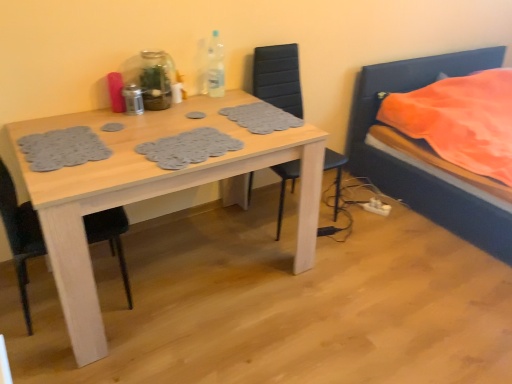
You are a GUI agent. You are given a task and a screenshot of the screen. Output one action in this format:
    pyautogui.click(x=<x>, y=<y>)
    Task: Click on the clear plastic bottle at upper center, the first bottle positioned from the right
    This screenshot has width=512, height=384.
    Given the screenshot: What is the action you would take?
    pyautogui.click(x=215, y=67)

What do you see at coordinates (20, 235) in the screenshot? The width and height of the screenshot is (512, 384). I see `black matte chair at left, which appears as the second chair when viewed from the right` at bounding box center [20, 235].

This screenshot has height=384, width=512. I want to click on white plastic power plugs and sockets at lower right, so click(x=376, y=207).

This screenshot has width=512, height=384. I want to click on black leather chair at center, marked as the 2th chair in a left-to-right arrangement, so [278, 77].

At what (x,y) coordinates should I click in order to perform the action: click on transparent glass bottle at upper center, which ranks as the 2th bottle in right-to-left order. Please return your answer as a coordinate pair (x, y). Looking at the image, I should click on (156, 80).

This screenshot has width=512, height=384. In order to click on orange fabric bed at right in this screenshot , I will do `click(415, 168)`.

From the picture: Is black matte chair at left, which ranks as the 1th chair in left-to-right order, further to camera compared to black leather chair at center, which ranks as the first chair in right-to-left order?

No.

Which point is more forward, (36,244) or (296,68)?

The point (36,244) is more forward.

In terms of width, does black matte chair at left, which ranks as the 1th chair in left-to-right order, look wider or thinner when compared to black leather chair at center, marked as the 2th chair in a left-to-right arrangement?

Clearly, black matte chair at left, which ranks as the 1th chair in left-to-right order, has less width compared to black leather chair at center, marked as the 2th chair in a left-to-right arrangement.

From a real-world perspective, is black matte chair at left, which appears as the second chair when viewed from the right, physically located above or below black leather chair at center, which ranks as the first chair in right-to-left order?

In terms of real-world spatial position, black matte chair at left, which appears as the second chair when viewed from the right, is above black leather chair at center, which ranks as the first chair in right-to-left order.

Is metallic silver shaker at table center, acting as the 1th bottle starting from the left, next to clear plastic bottle at upper center, which is the third bottle from left to right, and touching it?

No.

From a real-world perspective, does metallic silver shaker at table center, the 3th bottle positioned from the right, stand above clear plastic bottle at upper center, which is the third bottle from left to right?

No, from a real-world perspective, metallic silver shaker at table center, the 3th bottle positioned from the right, is not above clear plastic bottle at upper center, which is the third bottle from left to right.

Considering the sizes of objects metallic silver shaker at table center, the 3th bottle positioned from the right, and clear plastic bottle at upper center, the first bottle positioned from the right, in the image provided, who is smaller, metallic silver shaker at table center, the 3th bottle positioned from the right, or clear plastic bottle at upper center, the first bottle positioned from the right,?

metallic silver shaker at table center, the 3th bottle positioned from the right.

Consider the image. Are transparent glass bottle at upper center, which ranks as the 2th bottle in left-to-right order, and black leather chair at center, marked as the 2th chair in a left-to-right arrangement, making contact?

transparent glass bottle at upper center, which ranks as the 2th bottle in left-to-right order, and black leather chair at center, marked as the 2th chair in a left-to-right arrangement, are clearly separated.

From a real-world perspective, relative to black leather chair at center, marked as the 2th chair in a left-to-right arrangement, is transparent glass bottle at upper center, which ranks as the 2th bottle in left-to-right order, vertically above or below?

Clearly, from a real-world perspective, transparent glass bottle at upper center, which ranks as the 2th bottle in left-to-right order, is above black leather chair at center, marked as the 2th chair in a left-to-right arrangement.

Which is behind, transparent glass bottle at upper center, which ranks as the 2th bottle in right-to-left order, or black leather chair at center, which ranks as the first chair in right-to-left order?

transparent glass bottle at upper center, which ranks as the 2th bottle in right-to-left order, is more distant.

How much distance is there between transparent glass bottle at upper center, which ranks as the 2th bottle in left-to-right order, and black matte chair at left, which ranks as the 1th chair in left-to-right order?

transparent glass bottle at upper center, which ranks as the 2th bottle in left-to-right order, is 31.51 inches away from black matte chair at left, which ranks as the 1th chair in left-to-right order.

Is transparent glass bottle at upper center, which ranks as the 2th bottle in left-to-right order, placed right next to black matte chair at left, which appears as the second chair when viewed from the right?

No, transparent glass bottle at upper center, which ranks as the 2th bottle in left-to-right order, is not next to black matte chair at left, which appears as the second chair when viewed from the right.

Considering the positions of objects transparent glass bottle at upper center, which ranks as the 2th bottle in left-to-right order, and black matte chair at left, which ranks as the 1th chair in left-to-right order, in the image provided, who is behind, transparent glass bottle at upper center, which ranks as the 2th bottle in left-to-right order, or black matte chair at left, which ranks as the 1th chair in left-to-right order,?

transparent glass bottle at upper center, which ranks as the 2th bottle in left-to-right order, is behind.

From the image's perspective, is transparent glass bottle at upper center, which ranks as the 2th bottle in left-to-right order, positioned above or below black matte chair at left, which ranks as the 1th chair in left-to-right order?

Based on their image positions, transparent glass bottle at upper center, which ranks as the 2th bottle in left-to-right order, is located above black matte chair at left, which ranks as the 1th chair in left-to-right order.

Considering the sizes of light wood table at center and orange fabric bed at right in the image, is light wood table at center taller or shorter than orange fabric bed at right?

light wood table at center is shorter than orange fabric bed at right.

Which of these two, light wood table at center or orange fabric bed at right, is smaller?

With smaller size is light wood table at center.

From a real-world perspective, which is physically below, light wood table at center or orange fabric bed at right?

light wood table at center.

Is light wood table at center oriented towards orange fabric bed at right?

No, light wood table at center is not oriented towards orange fabric bed at right.

Is white plastic power plugs and sockets at lower right turned away from light wood table at center?

No, white plastic power plugs and sockets at lower right's orientation is not away from light wood table at center.

In the image, there is a light wood table at center. Where is `power plugs and sockets below it (from a real-world perspective)`? This screenshot has width=512, height=384. power plugs and sockets below it (from a real-world perspective) is located at coordinates (376, 207).

Which object is further away from the camera taking this photo, white plastic power plugs and sockets at lower right or light wood table at center?

white plastic power plugs and sockets at lower right is behind.

From a real-world perspective, which is physically below, white plastic power plugs and sockets at lower right or light wood table at center?

white plastic power plugs and sockets at lower right, from a real-world perspective.

Which is in front, point (18, 207) or point (318, 165)?

The point (18, 207) is more forward.

Consider the image. Can you confirm if black matte chair at left, which ranks as the 1th chair in left-to-right order, is shorter than light wood table at center?

Incorrect, the height of black matte chair at left, which ranks as the 1th chair in left-to-right order, does not fall short of that of light wood table at center.

Find the location of a particular element. chair that is the 2nd object above the light wood table at center (from a real-world perspective) is located at coordinates pyautogui.click(x=20, y=235).

Are black matte chair at left, which appears as the second chair when viewed from the right, and light wood table at center far apart?

No, black matte chair at left, which appears as the second chair when viewed from the right, is not far from light wood table at center.

You are a GUI agent. You are given a task and a screenshot of the screen. Output one action in this format:
    pyautogui.click(x=<x>, y=<y>)
    Task: Click on the chair on the left of black leather chair at center, marked as the 2th chair in a left-to-right arrangement
    
    Given the screenshot: What is the action you would take?
    click(x=20, y=235)

From the image's perspective, starting from the clear plastic bottle at upper center, which is the third bottle from left to right, which bottle is the 2nd one below? Please provide its 2D coordinates.

[(133, 99)]

Considering their positions, is clear plastic bottle at upper center, which is the third bottle from left to right, positioned closer to transparent glass bottle at upper center, which ranks as the 2th bottle in left-to-right order, than white plastic power plugs and sockets at lower right?

clear plastic bottle at upper center, which is the third bottle from left to right, is positioned closer to the anchor transparent glass bottle at upper center, which ranks as the 2th bottle in left-to-right order.

From the image, which object appears to be nearer to white plastic power plugs and sockets at lower right, metallic silver shaker at table center, the 3th bottle positioned from the right, or light wood table at center?

light wood table at center is positioned closer to the anchor white plastic power plugs and sockets at lower right.

Considering their positions, is white plastic power plugs and sockets at lower right positioned closer to light wood table at center than transparent glass bottle at upper center, which ranks as the 2th bottle in left-to-right order?

Based on the image, transparent glass bottle at upper center, which ranks as the 2th bottle in left-to-right order, appears to be nearer to light wood table at center.

Based on their spatial positions, is black leather chair at center, marked as the 2th chair in a left-to-right arrangement, or orange fabric bed at right closer to white plastic power plugs and sockets at lower right?

Based on the image, orange fabric bed at right appears to be nearer to white plastic power plugs and sockets at lower right.

Considering their positions, is transparent glass bottle at upper center, which ranks as the 2th bottle in right-to-left order, positioned further to metallic silver shaker at table center, the 3th bottle positioned from the right, than clear plastic bottle at upper center, the first bottle positioned from the right?

clear plastic bottle at upper center, the first bottle positioned from the right.

Based on their spatial positions, is light wood table at center or black leather chair at center, which ranks as the first chair in right-to-left order, closer to metallic silver shaker at table center, the 3th bottle positioned from the right?

Based on the image, light wood table at center appears to be nearer to metallic silver shaker at table center, the 3th bottle positioned from the right.

Which object lies nearer to the anchor point black leather chair at center, marked as the 2th chair in a left-to-right arrangement, orange fabric bed at right or light wood table at center?

light wood table at center lies closer to black leather chair at center, marked as the 2th chair in a left-to-right arrangement, than the other object.

Looking at the image, which one is located closer to white plastic power plugs and sockets at lower right, orange fabric bed at right or transparent glass bottle at upper center, which ranks as the 2th bottle in left-to-right order?

The object closer to white plastic power plugs and sockets at lower right is orange fabric bed at right.

Identify the location of kitchen & dining room table between black matte chair at left, which ranks as the 1th chair in left-to-right order, and metallic silver shaker at table center, the 3th bottle positioned from the right, from front to back. This screenshot has height=384, width=512. (151, 191).

Where is `kitchen & dining room table between black matte chair at left, which ranks as the 1th chair in left-to-right order, and white plastic power plugs and sockets at lower right, in the horizontal direction`? kitchen & dining room table between black matte chair at left, which ranks as the 1th chair in left-to-right order, and white plastic power plugs and sockets at lower right, in the horizontal direction is located at coordinates (151, 191).

Image resolution: width=512 pixels, height=384 pixels. I want to click on chair between metallic silver shaker at table center, acting as the 1th bottle starting from the left, and white plastic power plugs and sockets at lower right, in the horizontal direction, so click(278, 77).

Find the location of a particular element. This screenshot has height=384, width=512. chair between metallic silver shaker at table center, the 3th bottle positioned from the right, and orange fabric bed at right, in the horizontal direction is located at coordinates (278, 77).